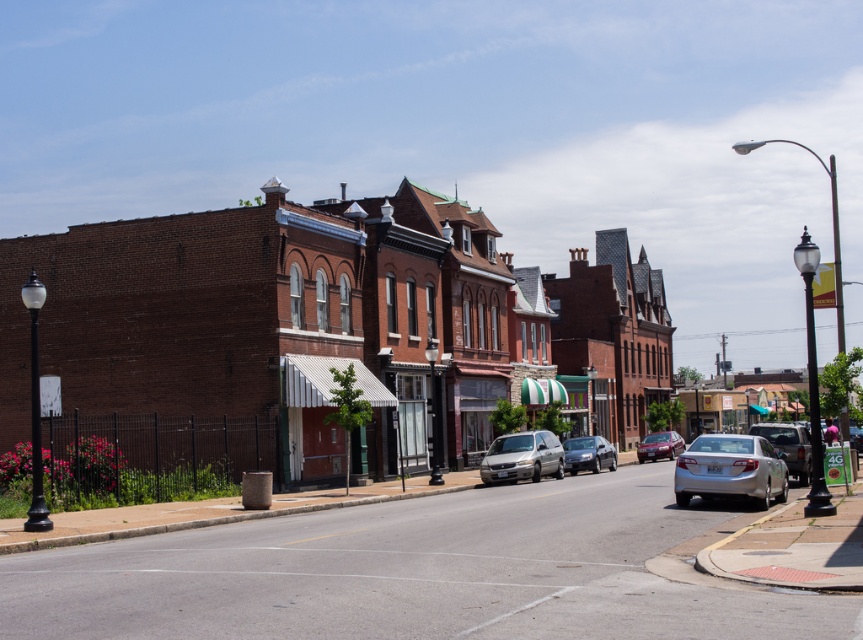
You are standing on the sidewalk in the street scene. There are two points marked on the ground. The first point is at coordinates point [306,429] and the second is at point [608,458]. Which point is closer to you?

Point [306,429] is closer to the viewer than point [608,458].